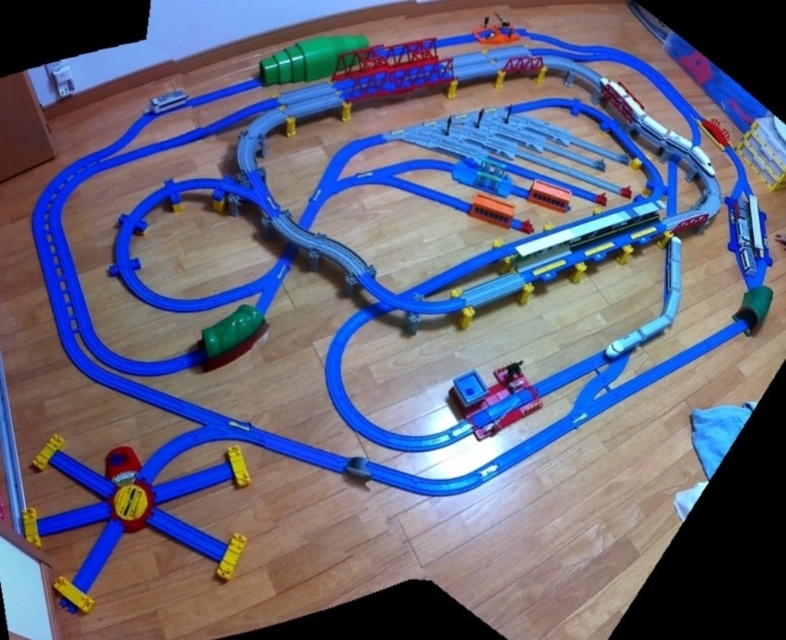
Question: Does shiny yellow plastic track at bottom left have a greater width compared to yellow plastic track at bottom left?

Choices:
 (A) no
 (B) yes

Answer: (B)

Question: Which of these objects is positioned farthest from the green rubber ball at lower center?

Choices:
 (A) yellow plastic track at bottom left
 (B) translucent plastic train at center

Answer: (B)

Question: Which object is farther from the camera taking this photo?

Choices:
 (A) green rubber ball at lower center
 (B) shiny yellow plastic track at bottom left

Answer: (A)

Question: In this image, where is shiny metallic train at upper right located relative to green rubber ball at lower center?

Choices:
 (A) left
 (B) right

Answer: (B)

Question: Is translucent plastic train at center positioned behind shiny metallic train at upper right?

Choices:
 (A) no
 (B) yes

Answer: (A)

Question: Which of the following is the farthest from the observer?

Choices:
 (A) [x=256, y=324]
 (B) [x=112, y=520]
 (C) [x=736, y=236]
 (D) [x=237, y=452]

Answer: (C)